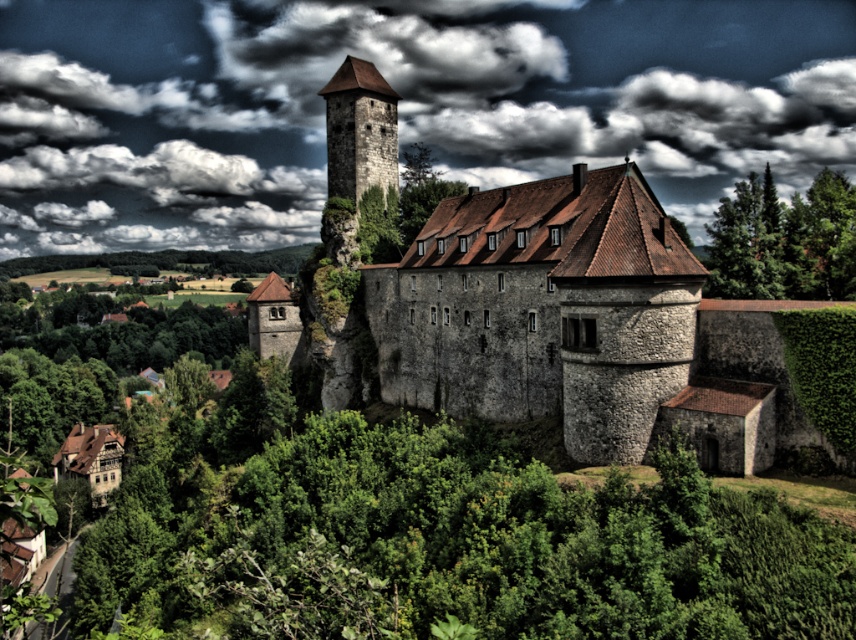
Measure the distance between cloudy sky at upper center and stone castle at center.

The distance of cloudy sky at upper center from stone castle at center is 162.69 meters.

Who is lower down, cloudy sky at upper center or stone castle at center?

stone castle at center is below.

Is point (389, 19) closer to camera compared to point (456, 337)?

That is False.

At what (x,y) coordinates should I click in order to perform the action: click on cloudy sky at upper center. Please return your answer as a coordinate pair (x, y). This screenshot has width=856, height=640. Looking at the image, I should click on (399, 106).

Is point (783, 214) positioned after point (385, 141)?

No, (783, 214) is in front of (385, 141).

Which is behind, point (809, 211) or point (381, 150)?

The point (381, 150) is more distant.

This screenshot has width=856, height=640. I want to click on green leafy tree at upper right, so click(783, 241).

Does stone castle at center have a greater height compared to dark gray cloud at upper center?

No.

Can you confirm if stone castle at center is positioned to the left of dark gray cloud at upper center?

No, stone castle at center is not to the left of dark gray cloud at upper center.

At what (x,y) coordinates should I click in order to perform the action: click on stone castle at center. Please return your answer as a coordinate pair (x, y). The width and height of the screenshot is (856, 640). Looking at the image, I should click on (550, 310).

Locate an element on the screen. stone castle at center is located at coordinates (550, 310).